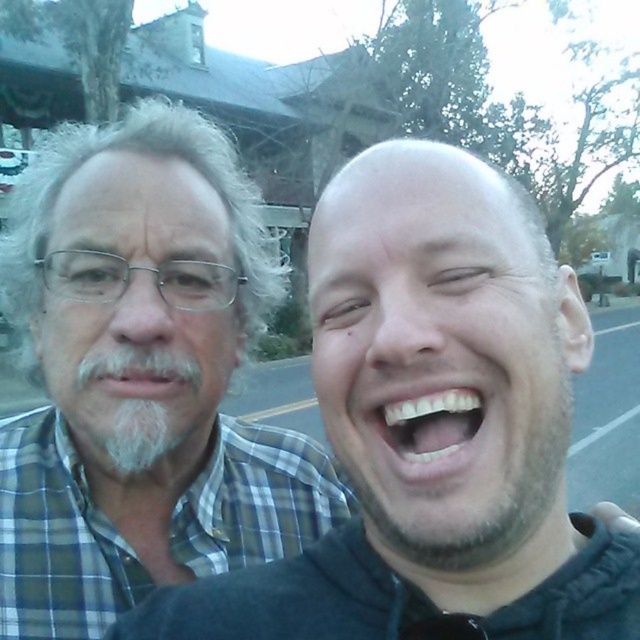
Does black matte jacket at center appear on the left side of gray plaid shirt at left?

No, black matte jacket at center is not to the left of gray plaid shirt at left.

Between black matte jacket at center and gray plaid shirt at left, which one appears on the left side from the viewer's perspective?

gray plaid shirt at left

Who is more distant from viewer, (420, 145) or (273, 476)?

The point (273, 476) is behind.

Locate an element on the screen. black matte jacket at center is located at coordinates (433, 428).